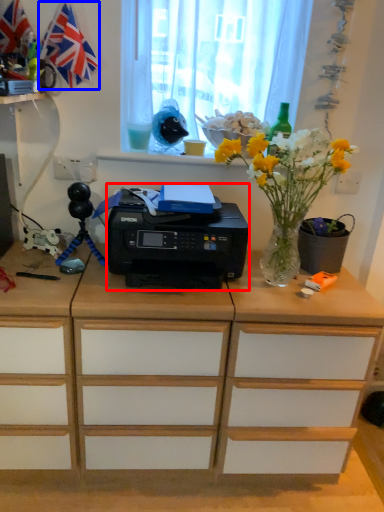
Question: Which of the following is the farthest to the observer, printer (highlighted by a red box) or flag (highlighted by a blue box)?

Choices:
 (A) printer
 (B) flag

Answer: (B)